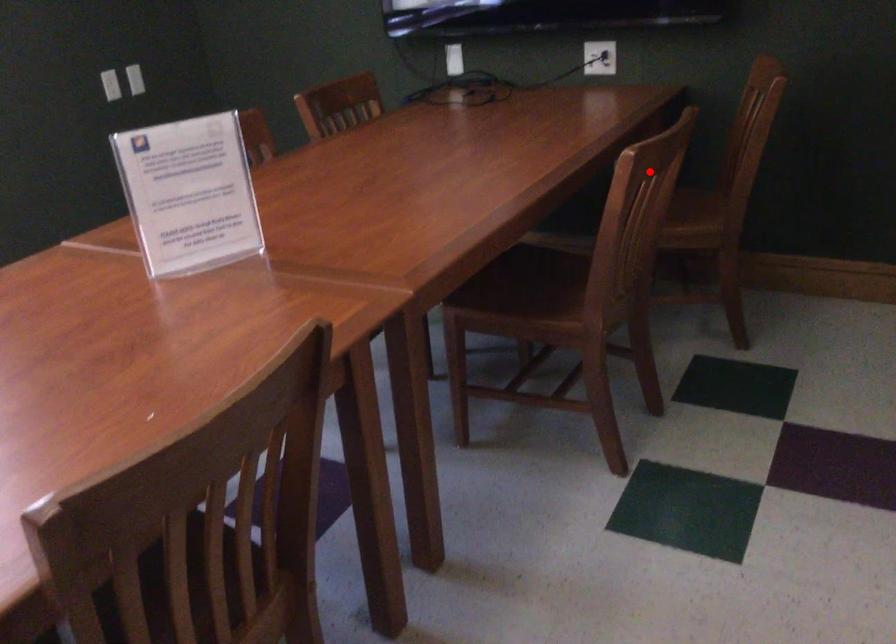
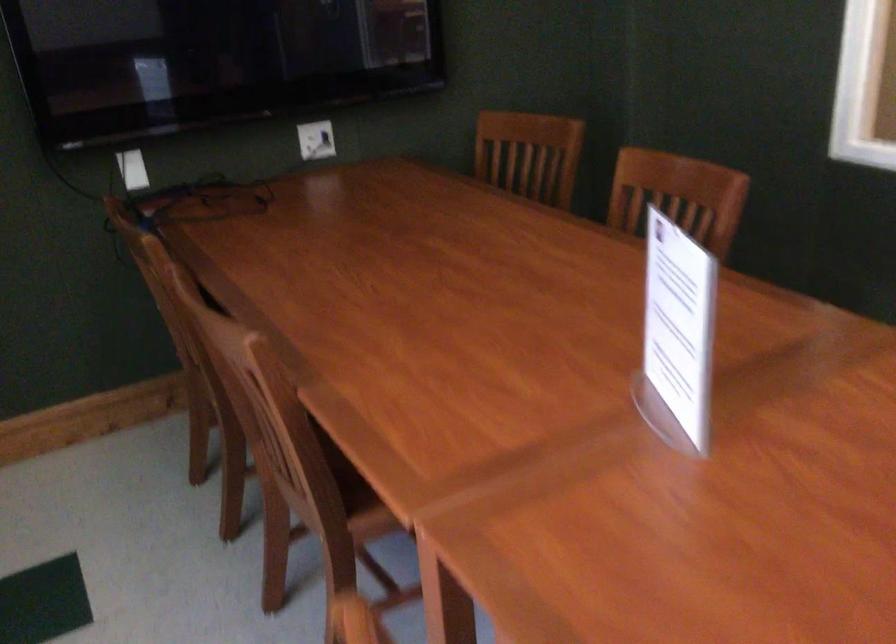
Question: A red point is marked in image1. In image2, is the corresponding 3D point closer to the camera or farther? Reply with the corresponding letter.

Choices:
 (A) The corresponding 3D point is closer.
 (B) The corresponding 3D point is farther.

Answer: (B)